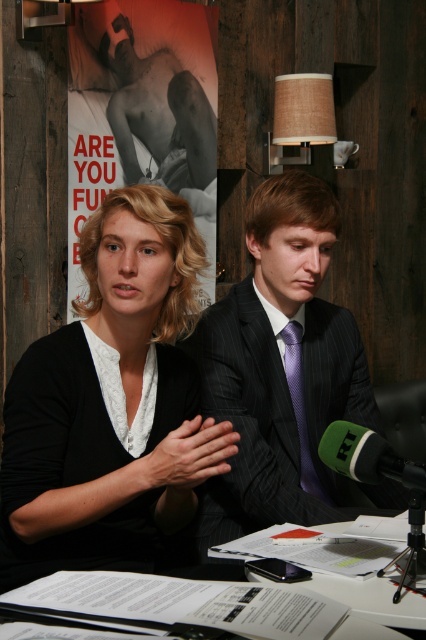
Which is more to the left, black matte sweater at center or dark gray pinstripe suit at center?

From the viewer's perspective, black matte sweater at center appears more on the left side.

Is point (28, 380) positioned after point (287, 422)?

No, (28, 380) is in front of (287, 422).

Identify the location of black matte sweater at center. This screenshot has width=426, height=640. click(x=111, y=403).

Who is taller, green foam microphone at lower center or purple satin tie at center?

purple satin tie at center

Where is `green foam microphone at lower center`? green foam microphone at lower center is located at coordinates (368, 458).

The image size is (426, 640). What do you see at coordinates (368, 458) in the screenshot?
I see `green foam microphone at lower center` at bounding box center [368, 458].

This screenshot has height=640, width=426. What are the coordinates of `green foam microphone at lower center` in the screenshot? It's located at (368, 458).

In the scene shown: Is black matte sweater at center to the left of green foam microphone at lower center from the viewer's perspective?

Yes, black matte sweater at center is to the left of green foam microphone at lower center.

Is point (138, 557) positioned before point (399, 477)?

No.

At what (x,y) coordinates should I click in order to perform the action: click on black matte sweater at center. Please return your answer as a coordinate pair (x, y). The height and width of the screenshot is (640, 426). Looking at the image, I should click on (111, 403).